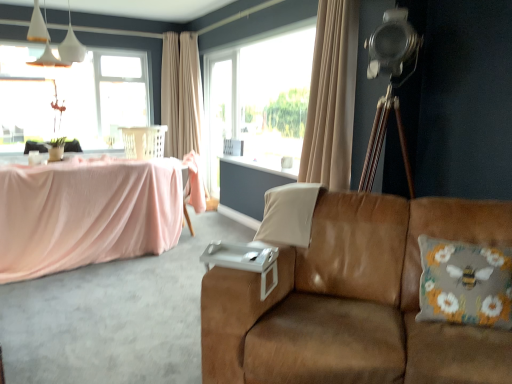
Question: Considering their positions, is beige fabric curtain at upper center, the 1th curtain viewed from the front, located in front of or behind floral-patterned fabric pillow at right, which appears as the 2th pillow when viewed from the left?

Choices:
 (A) behind
 (B) front

Answer: (A)

Question: From the image's perspective, is beige fabric curtain at upper center, arranged as the second curtain when viewed from the left, located above or below floral-patterned fabric pillow at right, which appears as the 2th pillow when viewed from the left?

Choices:
 (A) below
 (B) above

Answer: (B)

Question: Estimate the real-world distances between objects in this image. Which object is closer to the white plastic swivel chair at upper center?

Choices:
 (A) brown suede couch at center
 (B) white matte pendant lights at upper left
 (C) floral-patterned fabric pillow at right, which ranks as the 2th pillow in back-to-front order
 (D) transparent glass window at upper left
 (E) white fabric pillow at center, marked as the first pillow in a left-to-right arrangement

Answer: (B)

Question: Based on their relative distances, which object is nearer to the floral-patterned fabric pillow at right, the 1th pillow in the front-to-back sequence?

Choices:
 (A) white matte pendant lights at upper left
 (B) transparent glass screen door at center
 (C) white fabric pillow at center, marked as the first pillow in a left-to-right arrangement
 (D) white plastic swivel chair at upper center
 (E) transparent glass window at upper left

Answer: (C)